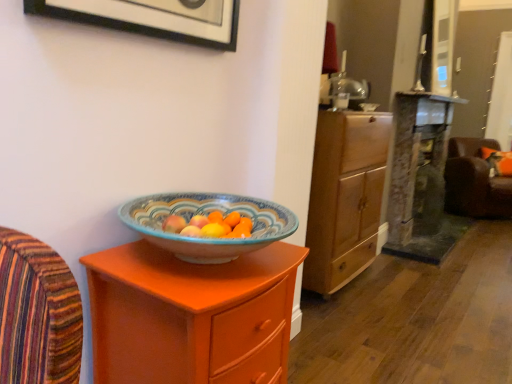
Image resolution: width=512 pixels, height=384 pixels. Describe the element at coordinates (498, 161) in the screenshot. I see `orange fabric pillow at right` at that location.

Find the location of a particular element. This screenshot has width=512, height=384. wooden cabinet at center is located at coordinates (345, 197).

Where is `orange fabric pillow at right`? This screenshot has height=384, width=512. orange fabric pillow at right is located at coordinates (498, 161).

Considering the positions of objects orange fabric pillow at right and brown leather swivel chair at right in the image provided, who is more to the left, orange fabric pillow at right or brown leather swivel chair at right?

brown leather swivel chair at right is more to the left.

From the image's perspective, is orange fabric pillow at right located above or below brown leather swivel chair at right?

orange fabric pillow at right is situated higher than brown leather swivel chair at right in the image.

Considering the sizes of orange fabric pillow at right and brown leather swivel chair at right in the image, is orange fabric pillow at right bigger or smaller than brown leather swivel chair at right?

orange fabric pillow at right is smaller than brown leather swivel chair at right.

How different are the orientations of orange fabric pillow at right and brown leather swivel chair at right in degrees?

The facing directions of orange fabric pillow at right and brown leather swivel chair at right are 17.8 degrees apart.

Consider the image. Is wooden cabinet at center facing away from orange fabric pillow at right?

No, wooden cabinet at center is not facing away from orange fabric pillow at right.

Does wooden cabinet at center have a lesser height compared to orange fabric pillow at right?

No.

Considering the positions of objects wooden cabinet at center and orange fabric pillow at right in the image provided, who is more to the left, wooden cabinet at center or orange fabric pillow at right?

wooden cabinet at center is more to the left.

From a real-world perspective, is wooden cabinet at center under orange fabric pillow at right?

Indeed, from a real-world perspective, wooden cabinet at center is positioned beneath orange fabric pillow at right.

Considering the sizes of objects wooden cabinet at center and matte orange cabinet at center in the image provided, who is smaller, wooden cabinet at center or matte orange cabinet at center?

Smaller between the two is matte orange cabinet at center.

Does point (334, 222) come in front of point (139, 254)?

No, it is not.

Is wooden cabinet at center far from matte orange cabinet at center?

Yes, wooden cabinet at center and matte orange cabinet at center are located far from each other.

Based on the photo, is matte black picture frame at upper left taller or shorter than orange fabric pillow at right?

Clearly, matte black picture frame at upper left is shorter compared to orange fabric pillow at right.

Which is more to the left, matte black picture frame at upper left or orange fabric pillow at right?

matte black picture frame at upper left is more to the left.

Considering the positions of point (60, 5) and point (490, 152), is point (60, 5) closer or farther from the camera than point (490, 152)?

Point (60, 5) is positioned closer to the camera compared to point (490, 152).

Would you say wooden cabinet at center is inside or outside matte black picture frame at upper left?

wooden cabinet at center is not enclosed by matte black picture frame at upper left.

Which of these two, wooden cabinet at center or matte black picture frame at upper left, is thinner?

matte black picture frame at upper left is thinner.

In the image, is wooden cabinet at center positioned in front of or behind matte black picture frame at upper left?

In the image, wooden cabinet at center appears behind matte black picture frame at upper left.

Is wooden cabinet at center facing towards brown leather swivel chair at right?

No, wooden cabinet at center is not oriented towards brown leather swivel chair at right.

In the scene shown: Is wooden cabinet at center not near brown leather swivel chair at right?

wooden cabinet at center is far away from brown leather swivel chair at right.

Which is more to the left, wooden cabinet at center or brown leather swivel chair at right?

wooden cabinet at center.

From a real-world perspective, who is located lower, wooden cabinet at center or brown leather swivel chair at right?

From a 3D spatial view, brown leather swivel chair at right is below.

Does brown leather swivel chair at right have a greater height compared to wooden cabinet at center?

Incorrect, the height of brown leather swivel chair at right is not larger of that of wooden cabinet at center.

Between point (495, 188) and point (329, 206), which one is positioned behind?

The point (495, 188) is farther.

From the image's perspective, between brown leather swivel chair at right and wooden cabinet at center, who is located below?

wooden cabinet at center appears lower in the image.

Is brown leather swivel chair at right next to wooden cabinet at center?

No, brown leather swivel chair at right is not beside wooden cabinet at center.

Find the location of a particular element. The width and height of the screenshot is (512, 384). pillow positioned vertically above the brown leather swivel chair at right (from a real-world perspective) is located at coordinates (498, 161).

Where is `cabinetry in front of the orange fabric pillow at right`? This screenshot has height=384, width=512. cabinetry in front of the orange fabric pillow at right is located at coordinates (345, 197).

Based on their spatial positions, is matte black picture frame at upper left or matte orange cabinet at center closer to brown leather swivel chair at right?

matte black picture frame at upper left.

Which object lies further to the anchor point orange fabric pillow at right, wooden cabinet at center or matte orange cabinet at center?

matte orange cabinet at center lies further to orange fabric pillow at right than the other object.

Looking at the image, which one is located further to brown leather swivel chair at right, wooden cabinet at center or matte black picture frame at upper left?

matte black picture frame at upper left lies further to brown leather swivel chair at right than the other object.

When comparing their distances from brown leather swivel chair at right, does matte black picture frame at upper left or orange fabric pillow at right seem closer?

Among the two, orange fabric pillow at right is located nearer to brown leather swivel chair at right.

Based on the photo, which object lies further to the anchor point brown leather swivel chair at right, matte orange cabinet at center or matte black picture frame at upper left?

The object further to brown leather swivel chair at right is matte orange cabinet at center.

Consider the image. Based on their spatial positions, is orange fabric pillow at right or matte orange cabinet at center further from brown leather swivel chair at right?

matte orange cabinet at center lies further to brown leather swivel chair at right than the other object.

From the image, which object appears to be nearer to orange fabric pillow at right, brown leather swivel chair at right or wooden cabinet at center?

Among the two, brown leather swivel chair at right is located nearer to orange fabric pillow at right.

Estimate the real-world distances between objects in this image. Which object is closer to matte orange cabinet at center, wooden cabinet at center or brown leather swivel chair at right?

wooden cabinet at center lies closer to matte orange cabinet at center than the other object.

Find the location of `cabinetry located between matte black picture frame at upper left and brown leather swivel chair at right in the depth direction`. cabinetry located between matte black picture frame at upper left and brown leather swivel chair at right in the depth direction is located at coordinates (345, 197).

The image size is (512, 384). I want to click on the chest of drawers located between matte black picture frame at upper left and brown leather swivel chair at right in the depth direction, so click(191, 316).

I want to click on swivel chair between matte orange cabinet at center and orange fabric pillow at right along the z-axis, so click(x=475, y=181).

Find the location of a particular element. The width and height of the screenshot is (512, 384). cabinetry positioned between matte orange cabinet at center and brown leather swivel chair at right from near to far is located at coordinates (345, 197).